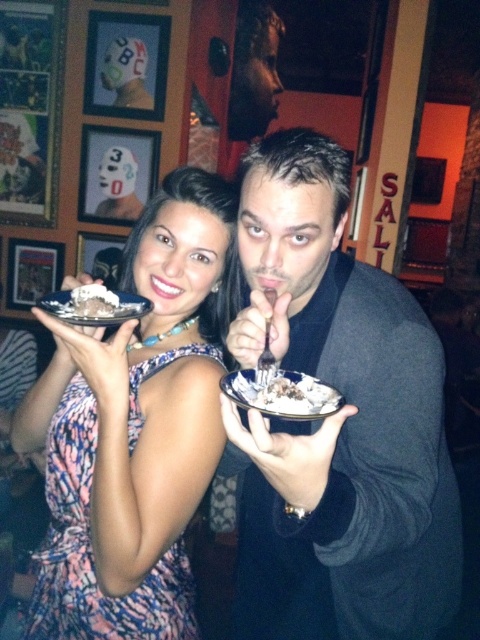
Question: Considering the real-world distances, which object is farthest from the white ceramic plate at center?

Choices:
 (A) silver metallic plate at left
 (B) white creamy dessert at center
 (C) matte black jacket at center

Answer: (A)

Question: Which point is closer to the camera taking this photo?

Choices:
 (A) (91, 490)
 (B) (302, 307)
 (C) (319, 404)

Answer: (C)

Question: Among these points, which one is farthest from the camera?

Choices:
 (A) (328, 612)
 (B) (224, 388)
 (C) (296, 372)
 (D) (90, 289)

Answer: (A)

Question: Observing the image, what is the correct spatial positioning of matte black jacket at center in reference to white creamy dessert at center?

Choices:
 (A) left
 (B) right

Answer: (B)

Question: Is matte black jacket at center closer to the viewer compared to white ceramic plate at center?

Choices:
 (A) no
 (B) yes

Answer: (A)

Question: Does matte black jacket at center lie behind silver metallic plate at left?

Choices:
 (A) no
 (B) yes

Answer: (A)